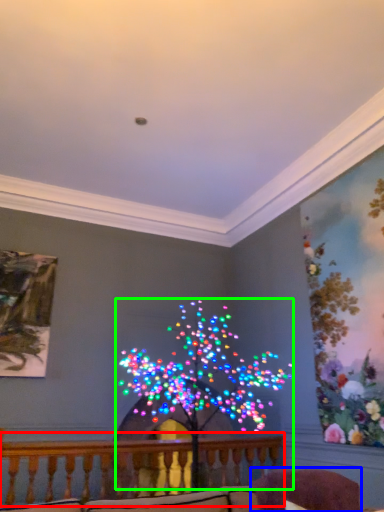
Question: Based on their relative distances, which object is nearer to balcony (highlighted by a red box)? Choose from swivel chair (highlighted by a blue box) and christmas decoration (highlighted by a green box).

Choices:
 (A) swivel chair
 (B) christmas decoration

Answer: (B)